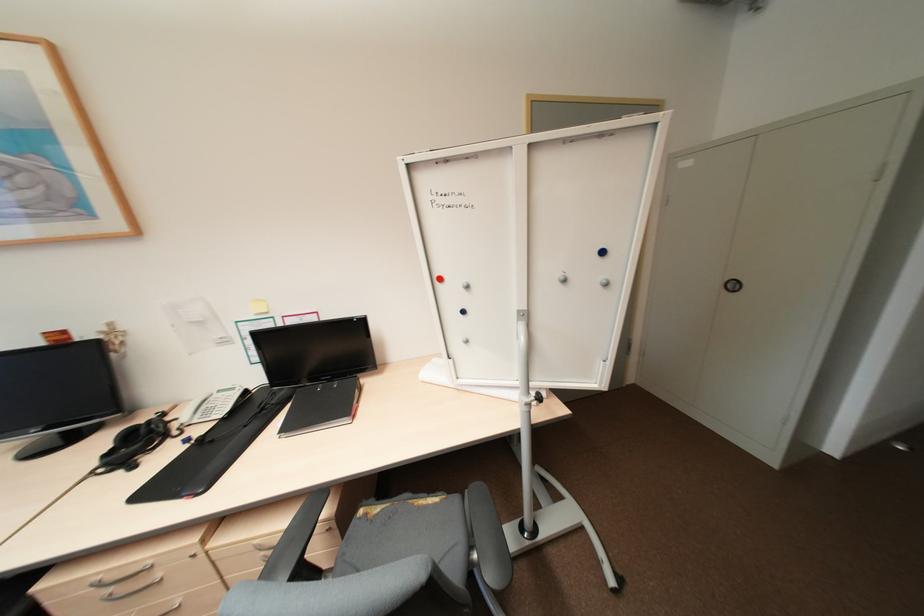
Where is `red magnet`? This screenshot has height=616, width=924. red magnet is located at coordinates (439, 278).